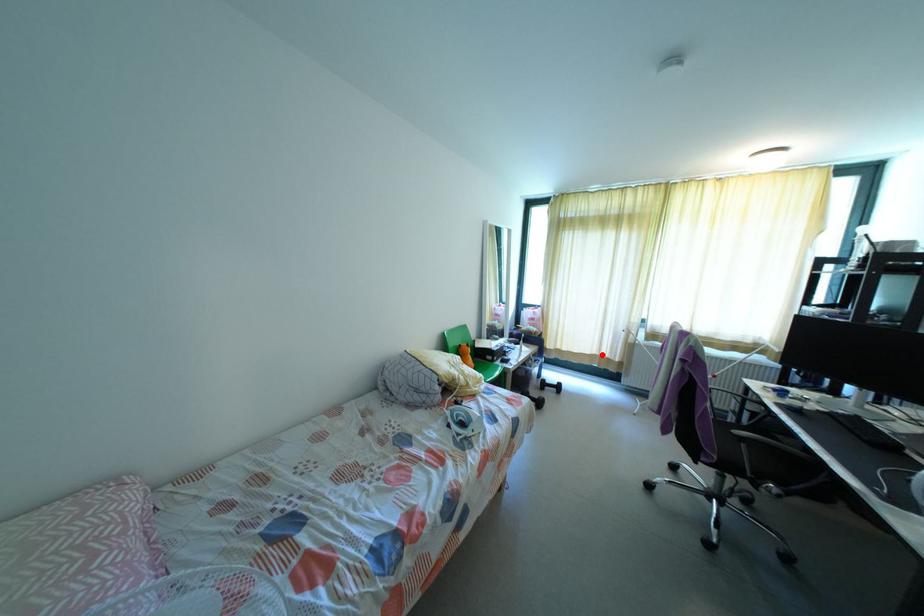
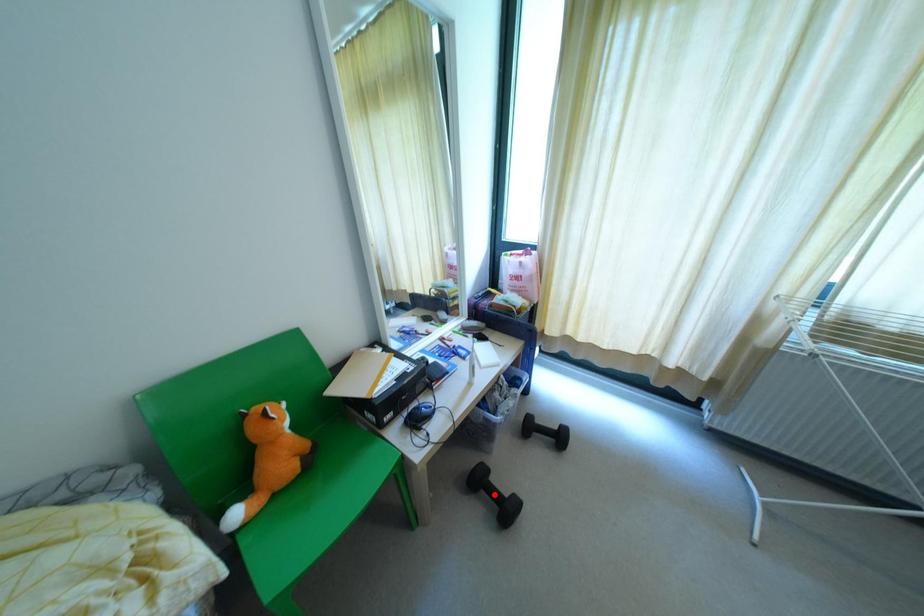
I am providing you with two images of the same scene from different viewpoints. A red point is marked on the first image and another point is marked on the second image. Is the marked point in image1 the same physical position as the marked point in image2?

No